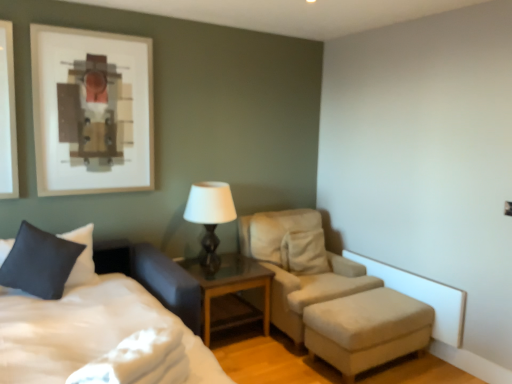
At what (x,y) coordinates should I click in order to perform the action: click on beige fabric ottoman at lower right. Please return your answer as a coordinate pair (x, y). The height and width of the screenshot is (384, 512). Looking at the image, I should click on (367, 329).

Describe the element at coordinates (210, 217) in the screenshot. This screenshot has width=512, height=384. I see `matte black table lamp at center` at that location.

Image resolution: width=512 pixels, height=384 pixels. I want to click on white soft bed at lower left, so click(x=90, y=332).

What do you see at coordinates (90, 332) in the screenshot? The width and height of the screenshot is (512, 384). I see `white soft bed at lower left` at bounding box center [90, 332].

Locate an element on the screen. glass wood nightstand at center is located at coordinates (230, 284).

Describe the element at coordinates (230, 284) in the screenshot. I see `glass wood nightstand at center` at that location.

The height and width of the screenshot is (384, 512). In order to click on beige fabric ottoman at lower right in this screenshot , I will do `click(367, 329)`.

How far apart are white soft bed at lower left and matte black table lamp at center?

white soft bed at lower left is 1.05 meters from matte black table lamp at center.

From a real-world perspective, which is physically above, white soft bed at lower left or matte black table lamp at center?

matte black table lamp at center is physically above.

Is white soft bed at lower left taller or shorter than matte black table lamp at center?

Considering their sizes, white soft bed at lower left has more height than matte black table lamp at center.

Is dark blue fabric pillow at lower left bigger than white soft bed at lower left?

No, dark blue fabric pillow at lower left is not bigger than white soft bed at lower left.

From a real-world perspective, is dark blue fabric pillow at lower left physically above white soft bed at lower left?

Correct, in the physical world, dark blue fabric pillow at lower left is higher than white soft bed at lower left.

Considering their positions, is dark blue fabric pillow at lower left located in front of or behind white soft bed at lower left?

Clearly, dark blue fabric pillow at lower left is behind white soft bed at lower left.

Is beige fabric chair at center taller or shorter than white soft bed at lower left?

In the image, beige fabric chair at center appears to be taller than white soft bed at lower left.

Which of these two, beige fabric chair at center or white soft bed at lower left, is smaller?

beige fabric chair at center is smaller.

Is beige fabric chair at center turned away from white soft bed at lower left?

No, white soft bed at lower left is not at the back of beige fabric chair at center.

Which is closer, (119, 305) or (294, 305)?

The point (119, 305) is more forward.

From a real-world perspective, which is physically above, white soft bed at lower left or beige fabric chair at center?

beige fabric chair at center is physically above.

Measure the distance between white soft bed at lower left and beige fabric chair at center.

A distance of 1.39 meters exists between white soft bed at lower left and beige fabric chair at center.

Considering the sizes of objects white soft bed at lower left and beige fabric chair at center in the image provided, who is bigger, white soft bed at lower left or beige fabric chair at center?

With larger size is white soft bed at lower left.

From a real-world perspective, is glass wood nightstand at center physically below beige fabric ottoman at lower right?

Incorrect, from a real-world perspective, glass wood nightstand at center is higher than beige fabric ottoman at lower right.

Considering the relative sizes of glass wood nightstand at center and beige fabric ottoman at lower right in the image provided, is glass wood nightstand at center taller than beige fabric ottoman at lower right?

Correct, glass wood nightstand at center is much taller as beige fabric ottoman at lower right.

From the image's perspective, relative to beige fabric ottoman at lower right, is glass wood nightstand at center above or below?

Based on their image positions, glass wood nightstand at center is located above beige fabric ottoman at lower right.

This screenshot has height=384, width=512. Find the location of `nightstand above the beige fabric ottoman at lower right (from a real-world perspective)`. nightstand above the beige fabric ottoman at lower right (from a real-world perspective) is located at coordinates (230, 284).

Consider the image. Is dark blue fabric pillow at lower left facing away from beige fabric chair at center?

No, dark blue fabric pillow at lower left is not facing away from beige fabric chair at center.

Choose the correct answer: Is dark blue fabric pillow at lower left inside beige fabric chair at center or outside it?

dark blue fabric pillow at lower left exists outside the volume of beige fabric chair at center.

Find the location of `chair on the right of dark blue fabric pillow at lower left`. chair on the right of dark blue fabric pillow at lower left is located at coordinates pos(298,264).

Would you say dark blue fabric pillow at lower left is a long distance from beige fabric chair at center?

Indeed, dark blue fabric pillow at lower left is not near beige fabric chair at center.

Which object is closer to the camera, beige fabric ottoman at lower right or white soft bed at lower left?

Positioned in front is white soft bed at lower left.

Would you say beige fabric ottoman at lower right is a long distance from white soft bed at lower left?

Yes, beige fabric ottoman at lower right and white soft bed at lower left are quite far apart.

Which of these two, beige fabric ottoman at lower right or white soft bed at lower left, is thinner?

beige fabric ottoman at lower right is thinner.

Locate an element on the screen. bed that is under the matte black table lamp at center (from a real-world perspective) is located at coordinates (90, 332).

You are a GUI agent. You are given a task and a screenshot of the screen. Output one action in this format:
    pyautogui.click(x=<x>, y=<y>)
    Task: Click on the pillow that appears behind the white soft bed at lower left
    The height and width of the screenshot is (384, 512).
    Given the screenshot: What is the action you would take?
    pyautogui.click(x=48, y=261)

Which object lies nearer to the anchor point dark blue fabric pillow at lower left, beige fabric chair at center or glass wood nightstand at center?

Among the two, glass wood nightstand at center is located nearer to dark blue fabric pillow at lower left.

Considering their positions, is matte black table lamp at center positioned closer to beige fabric ottoman at lower right than dark blue fabric pillow at lower left?

Among the two, matte black table lamp at center is located nearer to beige fabric ottoman at lower right.

Looking at the image, which one is located closer to glass wood nightstand at center, beige fabric chair at center or dark blue fabric pillow at lower left?

beige fabric chair at center lies closer to glass wood nightstand at center than the other object.

When comparing their distances from matte black table lamp at center, does dark blue fabric pillow at lower left or glass wood nightstand at center seem further?

dark blue fabric pillow at lower left lies further to matte black table lamp at center than the other object.

Looking at the image, which one is located closer to beige fabric chair at center, glass wood nightstand at center or matte black table lamp at center?

The object closer to beige fabric chair at center is glass wood nightstand at center.

In the scene shown: From the image, which object appears to be nearer to dark blue fabric pillow at lower left, beige fabric chair at center or white soft bed at lower left?

Among the two, white soft bed at lower left is located nearer to dark blue fabric pillow at lower left.

Based on their spatial positions, is glass wood nightstand at center or beige fabric chair at center further from beige fabric ottoman at lower right?

Among the two, glass wood nightstand at center is located further to beige fabric ottoman at lower right.

From the image, which object appears to be nearer to white soft bed at lower left, matte black table lamp at center or beige fabric ottoman at lower right?

matte black table lamp at center.

Where is `chair between white soft bed at lower left and matte black table lamp at center along the z-axis`? chair between white soft bed at lower left and matte black table lamp at center along the z-axis is located at coordinates click(x=298, y=264).

The image size is (512, 384). I want to click on chair situated between dark blue fabric pillow at lower left and beige fabric ottoman at lower right from left to right, so click(x=298, y=264).

This screenshot has height=384, width=512. Identify the location of chair located between matte black table lamp at center and beige fabric ottoman at lower right in the left-right direction. (298, 264).

Locate an element on the screen. table lamp between dark blue fabric pillow at lower left and beige fabric ottoman at lower right from left to right is located at coordinates (210, 217).